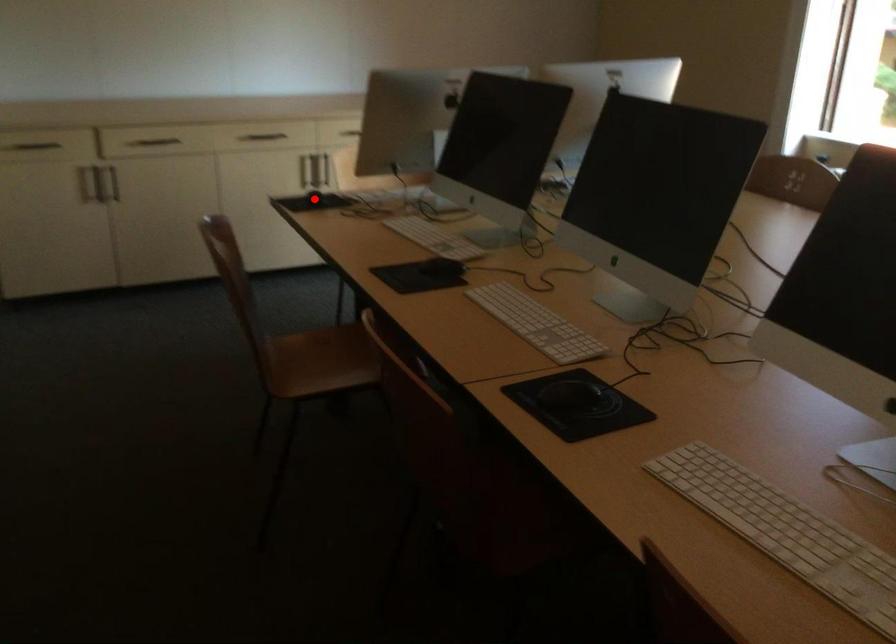
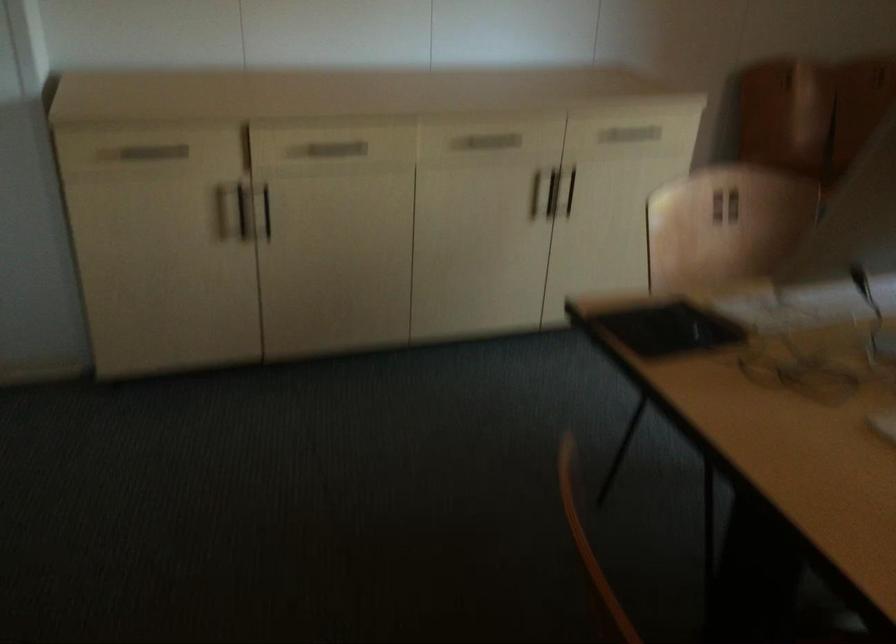
Find the pixel in the second image that matches the highlighted location in the first image.

(668, 328)